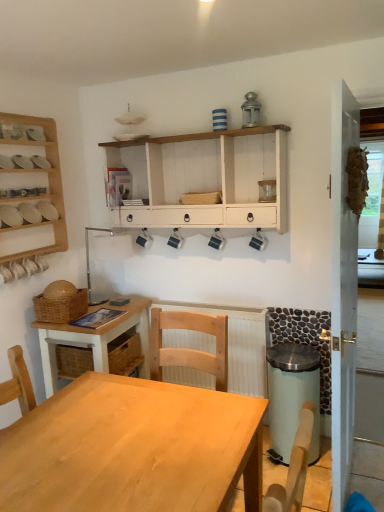
At what (x,y) coordinates should I click in order to perform the action: click on free space above white painted wood shelf at upper center, the 2th shelf from the left (from a real-world perspective). Please return your answer as a coordinate pair (x, y). This screenshot has width=384, height=512. Looking at the image, I should click on (x=184, y=136).